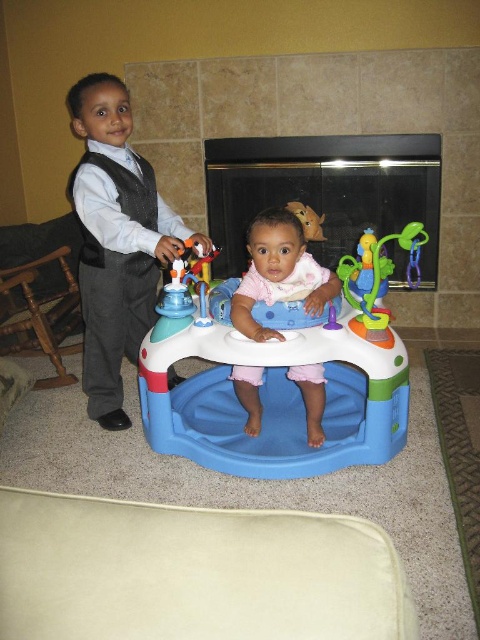
You are a parent trying to place a new toy on a shelf above the blue plastic baby activity center at center and the wooden chair at left. Which object should you stand on to reach the shelf if the shelf is at the same height as the top of the taller object?

The blue plastic baby activity center at center is taller than the wooden chair at left. Therefore, you should stand on the blue plastic baby activity center at center to reach the shelf since it is the taller object.

You are a parent trying to ensure your child stays within a safe zone in the living room. The safe zone is defined as the area below the glassy black fireplace at center. Can the baby in the pink fabric walker at center fit entirely within this safe zone?

The glassy black fireplace at center is taller than the pink fabric walker at center. Since the safe zone is below the fireplace, the baby in the pink fabric walker at center can fit entirely within the safe zone as the walker is shorter than the fireplace.